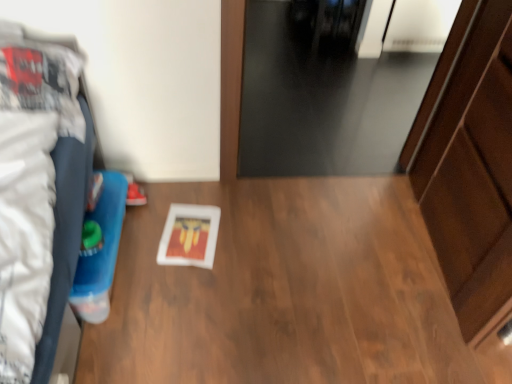
Identify the location of free spot in front of matte red shoe at lower left. The width and height of the screenshot is (512, 384). (147, 230).